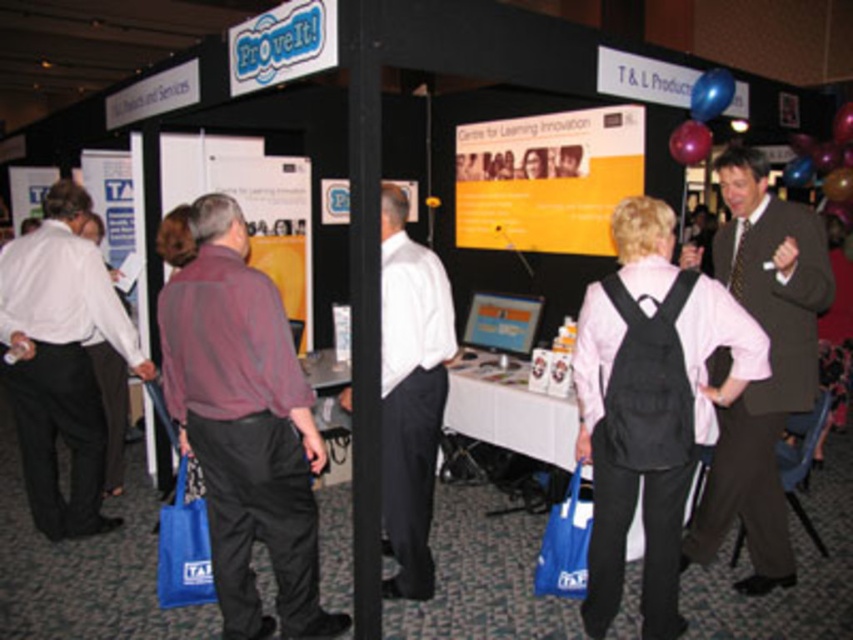
Who is lower down, dark brown suit at right or white shirt at center?

white shirt at center

Is point (820, 289) farther from viewer compared to point (445, 340)?

No, it is not.

At what (x,y) coordinates should I click in order to perform the action: click on dark brown suit at right. Please return your answer as a coordinate pair (x, y). This screenshot has width=853, height=640. Looking at the image, I should click on (769, 364).

Can you confirm if maroon fabric shirt at center is positioned to the right of dark brown suit at right?

In fact, maroon fabric shirt at center is to the left of dark brown suit at right.

Does maroon fabric shirt at center have a lesser height compared to dark brown suit at right?

Yes.

Is point (236, 490) in front of point (776, 432)?

Yes, it is in front of point (776, 432).

You are a GUI agent. You are given a task and a screenshot of the screen. Output one action in this format:
    pyautogui.click(x=<x>, y=<y>)
    Task: Click on the maroon fabric shirt at center
    Image resolution: width=853 pixels, height=640 pixels.
    Given the screenshot: What is the action you would take?
    pyautogui.click(x=245, y=426)

Can you confirm if dark brown suit at right is smaller than white shirt at left?

Incorrect, dark brown suit at right is not smaller in size than white shirt at left.

The image size is (853, 640). Identify the location of dark brown suit at right. (769, 364).

Describe the element at coordinates (769, 364) in the screenshot. I see `dark brown suit at right` at that location.

In order to click on dark brown suit at right in this screenshot , I will do `click(769, 364)`.